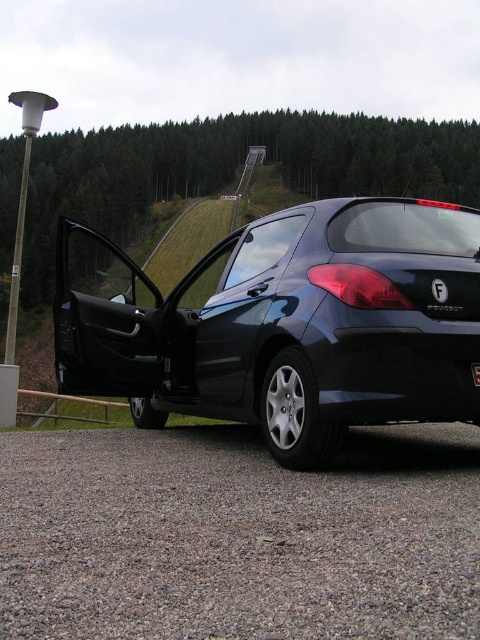
Question: Can you confirm if glossy dark blue hatchback at center is wider than black plastic license plate at center?

Choices:
 (A) no
 (B) yes

Answer: (B)

Question: Observing the image, what is the correct spatial positioning of glossy dark blue hatchback at center in reference to black plastic license plate at center?

Choices:
 (A) left
 (B) right

Answer: (A)

Question: Which point is farther from the camera taking this photo?

Choices:
 (A) (478, 369)
 (B) (409, 218)

Answer: (B)

Question: Can you confirm if glossy dark blue hatchback at center is positioned below black plastic license plate at center?

Choices:
 (A) no
 (B) yes

Answer: (A)

Question: Which point is closer to the camera?

Choices:
 (A) (402, 355)
 (B) (471, 369)

Answer: (A)